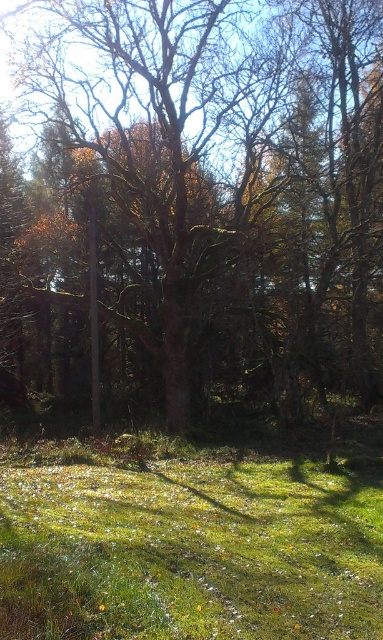
You are a hiker carrying a 2 meter long ladder. You need to place the ladder between the brown rough tree at center and the green grassy field at lower center. Is there enough space between them to place the ladder horizontally?

The brown rough tree at center and green grassy field at lower center are 11.91 meters apart from each other. Since the ladder is only 2 meters long, there is more than enough space to place it horizontally between them.

You are standing in the forest and see the brown rough tree at center and the green grassy field at lower center. Which object is higher up in the scene?

The brown rough tree at center is located above the green grassy field at lower center, so it is higher up in the scene.

You are a hiker standing on the green grassy field at lower center and want to reach the brown rough tree at center. Which direction should you walk to get there?

The brown rough tree at center is positioned on the right side of green grassy field at lower center, so you should walk to the right to reach it.